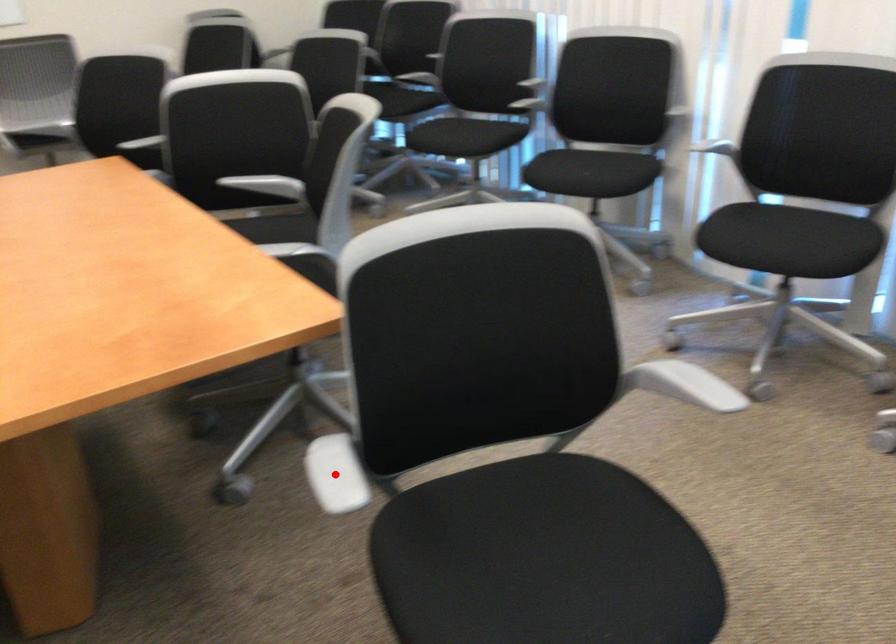
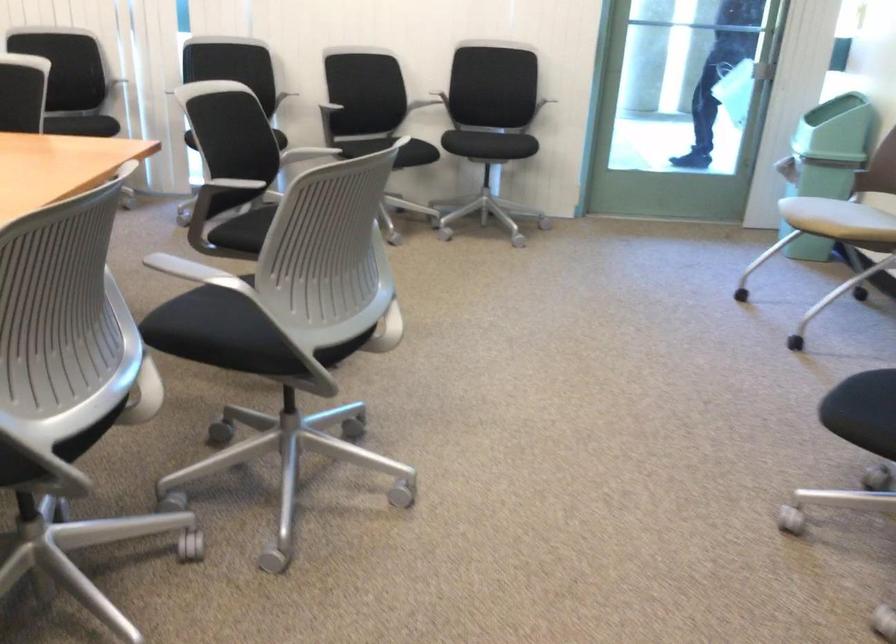
Question: I am providing you with two images of the same scene from different viewpoints. A red point is marked on the first image. Is the red point's position out of view in image 2?

Choices:
 (A) Yes
 (B) No

Answer: (A)